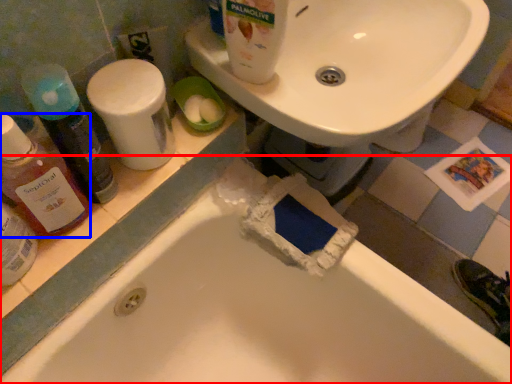
Question: Which of the following is the farthest to the observer, bathtub (highlighted by a red box) or cleaning product (highlighted by a blue box)?

Choices:
 (A) bathtub
 (B) cleaning product

Answer: (B)